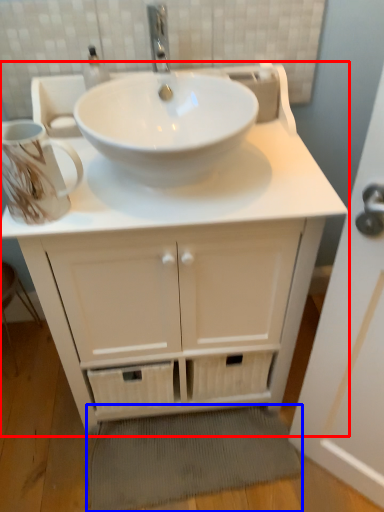
Question: Which object is closer to the camera taking this photo, bathroom cabinet (highlighted by a red box) or bath mat (highlighted by a blue box)?

Choices:
 (A) bathroom cabinet
 (B) bath mat

Answer: (A)